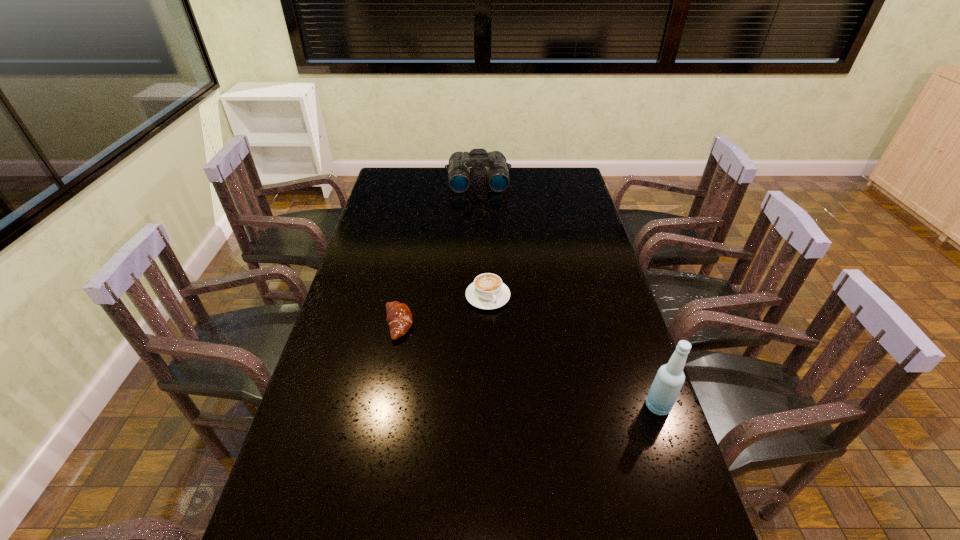
Where is `vacant spot on the desktop that is between the shortest object and the rightmost object and is positioned through the lenses of the third shortest object`? This screenshot has width=960, height=540. vacant spot on the desktop that is between the shortest object and the rightmost object and is positioned through the lenses of the third shortest object is located at coordinates (492, 354).

This screenshot has width=960, height=540. In order to click on free space on the desktop that is between the shortest object and the tallest object and is positioned on the side of the third tallest object with the handle in this screenshot , I will do `click(526, 364)`.